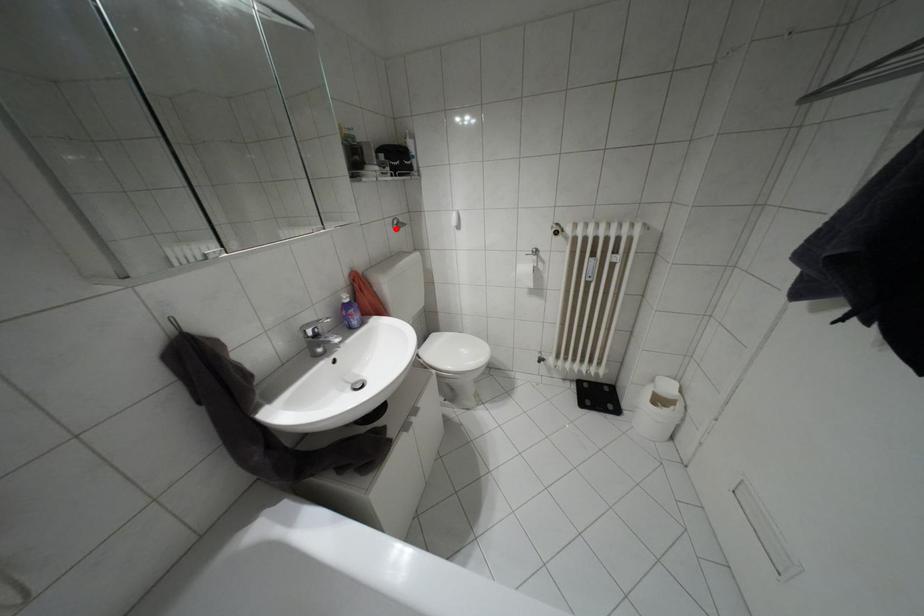
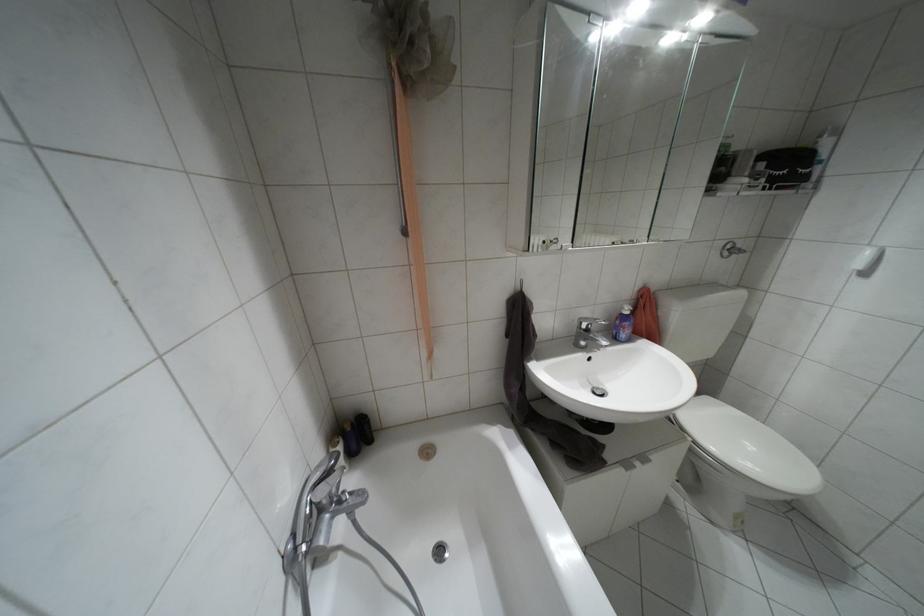
Question: I am providing you with two images of the same scene from different viewpoints. Image1 has a red point marked. In image2, the corresponding 3D location appears at what relative position? Reply with the corresponding letter.

Choices:
 (A) Closer
 (B) Farther

Answer: (B)